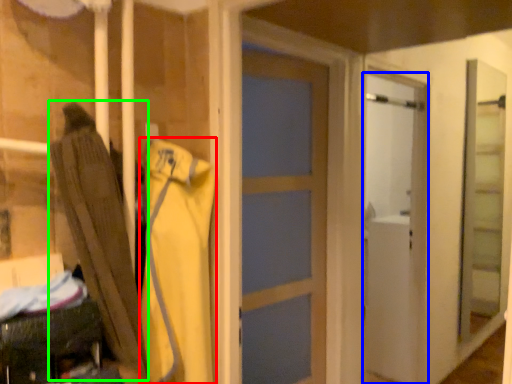
Question: Considering the real-world distances, which object is closest to clothing (highlighted by a red box)? door (highlighted by a blue box) or umbrella (highlighted by a green box).

Choices:
 (A) door
 (B) umbrella

Answer: (B)